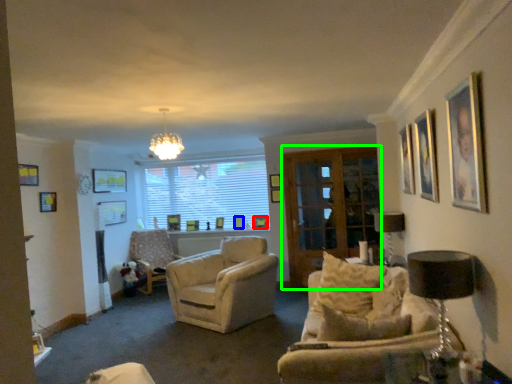
Question: Based on their relative distances, which object is farther from picture frame (highlighted by a red box)? Choose from picture frame (highlighted by a blue box) and screen door (highlighted by a green box).

Choices:
 (A) picture frame
 (B) screen door

Answer: (B)